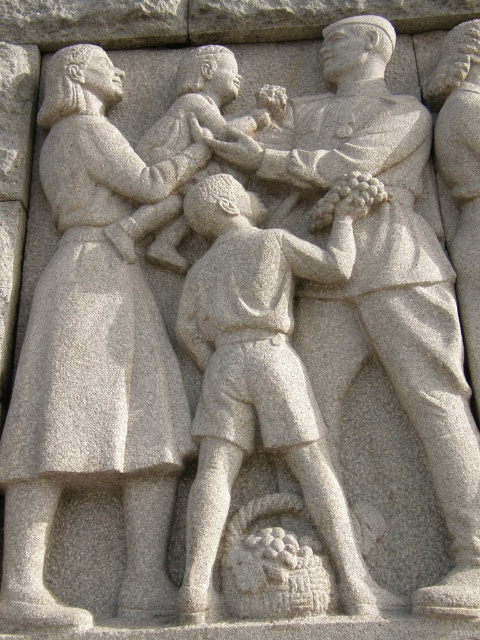
Is point (81, 268) farther from viewer compared to point (255, 348)?

Yes.

Is granite statue of woman holding child at left taller than granite textured boy at center?

Yes.

Describe the element at coordinates (93, 356) in the screenshot. I see `granite statue of woman holding child at left` at that location.

You are a GUI agent. You are given a task and a screenshot of the screen. Output one action in this format:
    pyautogui.click(x=<x>, y=<y>)
    Task: Click on the granite statue of woman holding child at left
    The height and width of the screenshot is (640, 480).
    Given the screenshot: What is the action you would take?
    pyautogui.click(x=93, y=356)